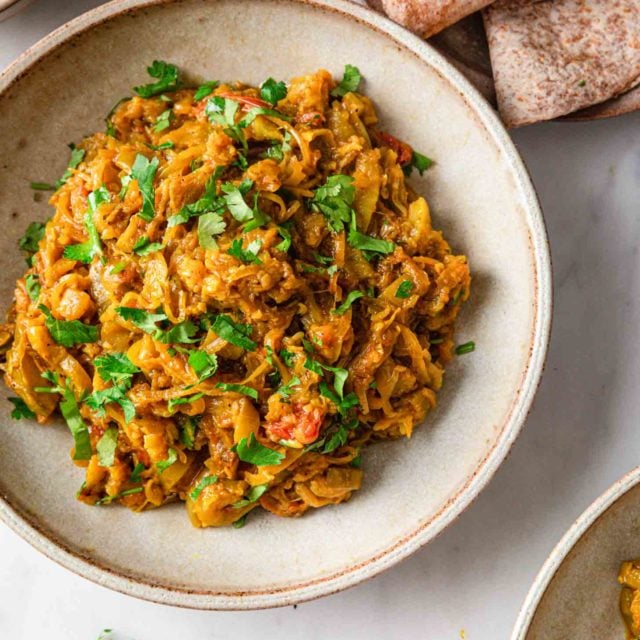
Find the location of a particular element. rim of plate is located at coordinates (543, 282).